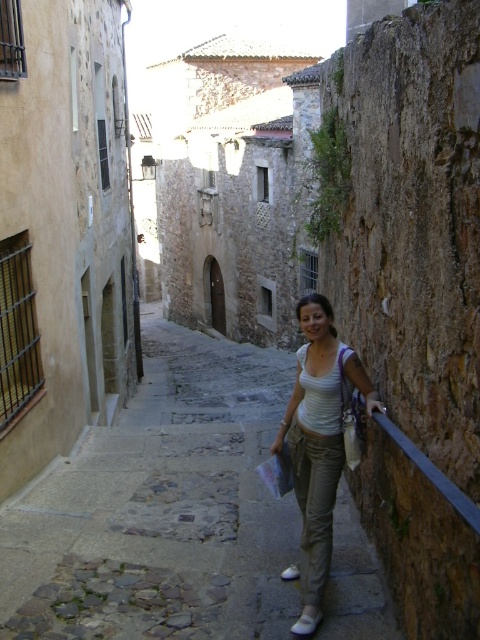
Question: Can you confirm if matte stone stairs at center is smaller than light beige cotton pants at center?

Choices:
 (A) no
 (B) yes

Answer: (A)

Question: Can you confirm if matte stone stairs at center is smaller than light beige cotton pants at center?

Choices:
 (A) no
 (B) yes

Answer: (A)

Question: Is matte stone stairs at center in front of light beige cotton pants at center?

Choices:
 (A) yes
 (B) no

Answer: (A)